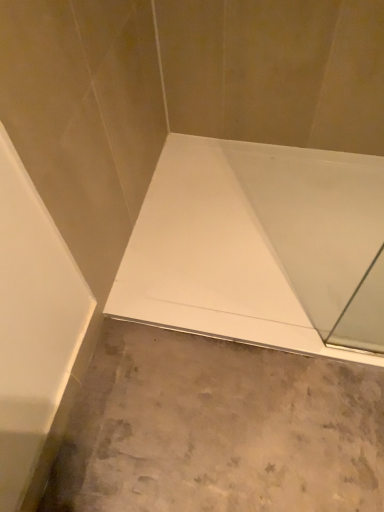
The image size is (384, 512). What do you see at coordinates (252, 242) in the screenshot?
I see `white glossy bath at center` at bounding box center [252, 242].

The width and height of the screenshot is (384, 512). Identify the location of white glossy bath at center. (252, 242).

Locate an element on the screen. This screenshot has height=512, width=384. white glossy bath at center is located at coordinates (252, 242).